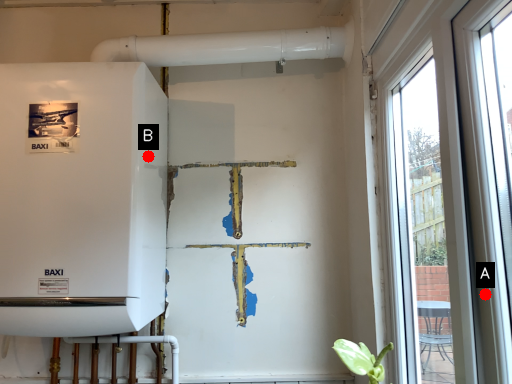
Question: Two points are circled on the image, labeled by A and B beside each circle. Which point appears farthest from the camera in this image?

Choices:
 (A) A is further
 (B) B is further

Answer: (B)